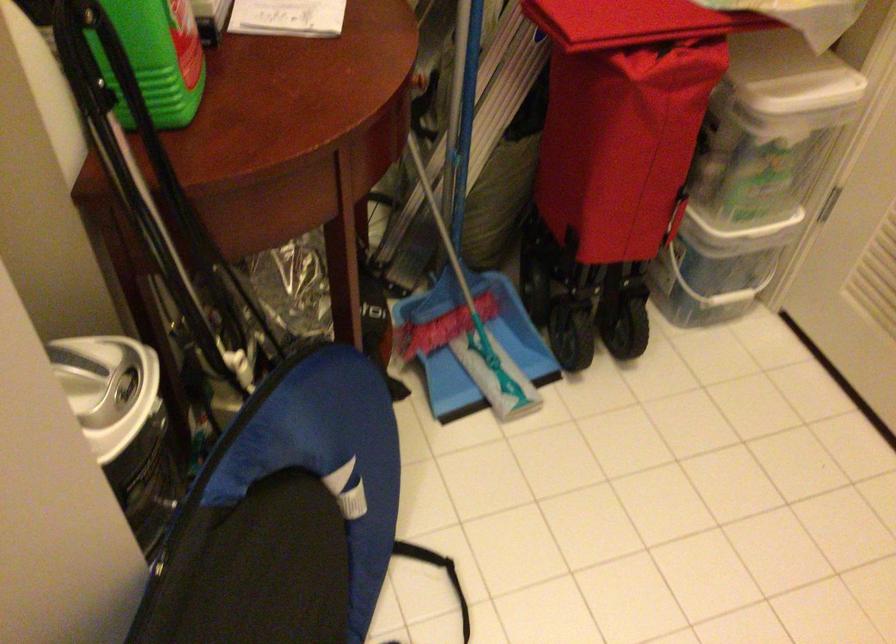
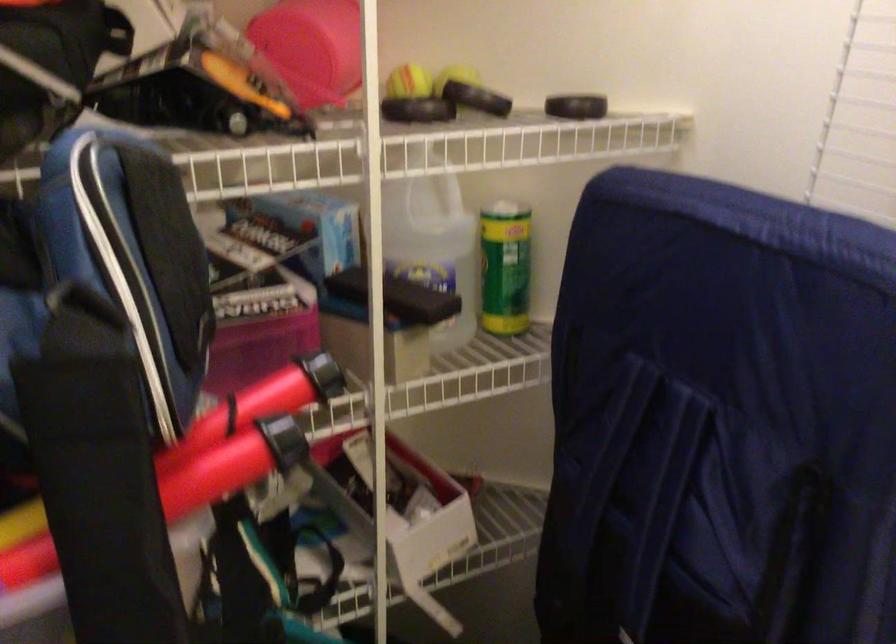
Question: The camera is either moving clockwise (left) or counter-clockwise (right) around the object. The first image is from the beginning of the video and the second image is from the end. Is the camera moving left or right when shooting the video?

Choices:
 (A) Left
 (B) Right

Answer: (B)